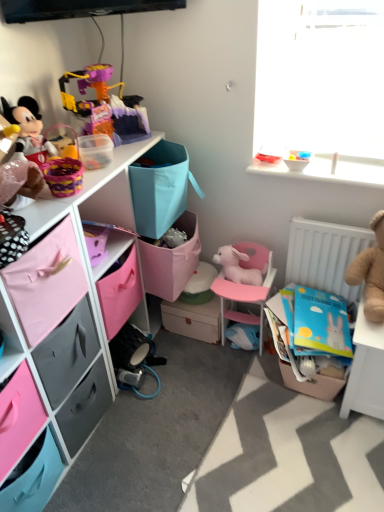
The width and height of the screenshot is (384, 512). Describe the element at coordinates (334, 163) in the screenshot. I see `white plastic spoon at upper right, the 2th toy from the right` at that location.

Locate an element on the screen. The width and height of the screenshot is (384, 512). matte pink storage box at center, which is the first storage box in left-to-right order is located at coordinates (193, 319).

In order to face brown plush bear at right, which is the 1th toy in right-to-left order, should I rotate leftwards or rightwards?

Rotate right and turn 23.357 degrees.

Locate an element on the screen. This screenshot has height=512, width=384. white plastic spoon at upper right, the 2th toy from the right is located at coordinates (334, 163).

Considering the relative sizes of plastic toy at upper left, the second toy positioned from the left, and blue cardboard box at lower right, placed as the 1th storage box when sorted from right to left, in the image provided, is plastic toy at upper left, the second toy positioned from the left, thinner than blue cardboard box at lower right, placed as the 1th storage box when sorted from right to left,?

Indeed, plastic toy at upper left, the second toy positioned from the left, has a lesser width compared to blue cardboard box at lower right, placed as the 1th storage box when sorted from right to left.

In terms of size, does plastic toy at upper left, the second toy positioned from the left, appear bigger or smaller than blue cardboard box at lower right, the 2th storage box from the back?

In the image, plastic toy at upper left, the second toy positioned from the left, appears to be larger than blue cardboard box at lower right, the 2th storage box from the back.

From the picture: From a real-world perspective, which object rests below the other?

blue cardboard box at lower right, placed as the 1th storage box when sorted from right to left.

Locate an element on the screen. the 1st storage box behind the plastic toy at upper left, placed as the sixth toy when sorted from right to left is located at coordinates (315, 340).

From the image's perspective, is brown plush bear at right, the 7th toy when ordered from left to right, positioned above or below white plastic spoon at upper right, the 2th toy from the right?

Based on their image positions, brown plush bear at right, the 7th toy when ordered from left to right, is located beneath white plastic spoon at upper right, the 2th toy from the right.

Is point (352, 279) farther from camera compared to point (334, 156)?

No, (352, 279) is in front of (334, 156).

Does brown plush bear at right, the 7th toy when ordered from left to right, appear on the left side of white plastic spoon at upper right, the 2th toy from the right?

No.

Is brown plush bear at right, which is the 1th toy in right-to-left order, positioned beyond the bounds of white plastic spoon at upper right, the 6th toy viewed from the left?

brown plush bear at right, which is the 1th toy in right-to-left order, lies outside white plastic spoon at upper right, the 6th toy viewed from the left,'s area.

Considering the relative sizes of pink plush rabbit at center, which is the 5th toy in right-to-left order, and rubber duck at upper right, placed as the 4th toy when sorted from left to right, in the image provided, is pink plush rabbit at center, which is the 5th toy in right-to-left order, taller than rubber duck at upper right, placed as the 4th toy when sorted from left to right,?

Yes.

Based on the photo, does pink plush rabbit at center, which is the 5th toy in right-to-left order, have a lesser width compared to rubber duck at upper right, placed as the 4th toy when sorted from left to right?

Incorrect, the width of pink plush rabbit at center, which is the 5th toy in right-to-left order, is not less than that of rubber duck at upper right, placed as the 4th toy when sorted from left to right.

Is point (224, 267) closer to viewer compared to point (260, 160)?

No.

Can you tell me how much pink plush rabbit at center, which is the 3th toy in left-to-right order, and rubber duck at upper right, placed as the 4th toy when sorted from left to right, differ in facing direction?

0.894 degrees separate the facing orientations of pink plush rabbit at center, which is the 3th toy in left-to-right order, and rubber duck at upper right, placed as the 4th toy when sorted from left to right.

Considering the positions of objects blue cardboard box at lower right, which is the 1th storage box from front to back, and pink fabric drawer at lower left, positioned as the second drawer in back-to-front order, in the image provided, who is more to the right, blue cardboard box at lower right, which is the 1th storage box from front to back, or pink fabric drawer at lower left, positioned as the second drawer in back-to-front order,?

blue cardboard box at lower right, which is the 1th storage box from front to back.

Measure the distance between blue cardboard box at lower right, placed as the 1th storage box when sorted from right to left, and pink fabric drawer at lower left, positioned as the second drawer in back-to-front order.

The distance of blue cardboard box at lower right, placed as the 1th storage box when sorted from right to left, from pink fabric drawer at lower left, positioned as the second drawer in back-to-front order, is 97.15 centimeters.

Is blue cardboard box at lower right, which is the 1th storage box from front to back, thinner than pink fabric drawer at lower left, positioned as the second drawer in back-to-front order?

No, blue cardboard box at lower right, which is the 1th storage box from front to back, is not thinner than pink fabric drawer at lower left, positioned as the second drawer in back-to-front order.

Does blue cardboard box at lower right, placed as the 1th storage box when sorted from right to left, have a smaller size compared to pink fabric drawer at lower left, positioned as the second drawer in back-to-front order?

Correct, blue cardboard box at lower right, placed as the 1th storage box when sorted from right to left, occupies less space than pink fabric drawer at lower left, positioned as the second drawer in back-to-front order.

Is the position of translucent plastic bowl at upper right, which is counted as the 3th toy, starting from the right, more distant than that of blue cardboard box at lower right, the 2th storage box from the back?

Yes, it is.

Which is correct: translucent plastic bowl at upper right, which is counted as the 3th toy, starting from the right, is inside blue cardboard box at lower right, marked as the second storage box in a left-to-right arrangement, or outside of it?

translucent plastic bowl at upper right, which is counted as the 3th toy, starting from the right, is located beyond the bounds of blue cardboard box at lower right, marked as the second storage box in a left-to-right arrangement.

How far apart are translucent plastic bowl at upper right, which is counted as the 3th toy, starting from the right, and blue cardboard box at lower right, the 2th storage box from the back?

translucent plastic bowl at upper right, which is counted as the 3th toy, starting from the right, is 24.87 inches from blue cardboard box at lower right, the 2th storage box from the back.

Is translucent plastic bowl at upper right, which is counted as the 3th toy, starting from the right, shorter than blue cardboard box at lower right, marked as the second storage box in a left-to-right arrangement?

Indeed, translucent plastic bowl at upper right, which is counted as the 3th toy, starting from the right, has a lesser height compared to blue cardboard box at lower right, marked as the second storage box in a left-to-right arrangement.

Could you tell me if pink fabric storage unit at left is turned towards pink plastic chair at center?

Yes, pink fabric storage unit at left is aimed at pink plastic chair at center.

Is pink plastic chair at center completely or partially inside pink fabric storage unit at left?

Actually, pink plastic chair at center is outside pink fabric storage unit at left.

Identify the location of chair that appears on the right of pink fabric storage unit at left. This screenshot has width=384, height=512. (246, 288).

Is point (114, 195) behind point (248, 303)?

No, (114, 195) is in front of (248, 303).

In the scene shown: Can you confirm if pink fabric drawer at lower left, which is the first drawer in front-to-back order, is smaller than matte pink storage box at center, placed as the 1th storage box when sorted from back to front?

Incorrect, pink fabric drawer at lower left, which is the first drawer in front-to-back order, is not smaller in size than matte pink storage box at center, placed as the 1th storage box when sorted from back to front.

Which is correct: pink fabric drawer at lower left, which is the first drawer in front-to-back order, is inside matte pink storage box at center, which is the first storage box in left-to-right order, or outside of it?

pink fabric drawer at lower left, which is the first drawer in front-to-back order, exists outside the volume of matte pink storage box at center, which is the first storage box in left-to-right order.

Relative to matte pink storage box at center, placed as the 1th storage box when sorted from back to front, is pink fabric drawer at lower left, positioned as the second drawer in back-to-front order, in front or behind?

In the image, pink fabric drawer at lower left, positioned as the second drawer in back-to-front order, appears in front of matte pink storage box at center, placed as the 1th storage box when sorted from back to front.

Where is `the 1st storage box positioned below the plastic toy at upper left, placed as the sixth toy when sorted from right to left (from the image's perspective)`? the 1st storage box positioned below the plastic toy at upper left, placed as the sixth toy when sorted from right to left (from the image's perspective) is located at coordinates (315, 340).

From the image's perspective, which toy is the 1st one above the brown plush bear at right, which is the 1th toy in right-to-left order? Please provide its 2D coordinates.

[(334, 163)]

Which object lies further to the anchor point plastic toy at upper left, placed as the sixth toy when sorted from right to left, brown plush bear at right, the 7th toy when ordered from left to right, or pink plush rabbit at center, which is the 3th toy in left-to-right order?

brown plush bear at right, the 7th toy when ordered from left to right, lies further to plastic toy at upper left, placed as the sixth toy when sorted from right to left, than the other object.

Considering their positions, is pink plush rabbit at center, which is the 5th toy in right-to-left order, positioned further to matte black plush toy at left, which is counted as the seventh toy, starting from the right, than translucent plastic bowl at upper right, which is counted as the 3th toy, starting from the right?

translucent plastic bowl at upper right, which is counted as the 3th toy, starting from the right, lies further to matte black plush toy at left, which is counted as the seventh toy, starting from the right, than the other object.

Consider the image. From the image, which object appears to be farther from gray matte drawer at lower left, placed as the 2th drawer when sorted from front to back, translucent plastic bowl at upper right, which is counted as the 3th toy, starting from the right, or matte black plush toy at left, which is counted as the seventh toy, starting from the right?

translucent plastic bowl at upper right, which is counted as the 3th toy, starting from the right.

Considering their positions, is blue cardboard box at lower right, marked as the second storage box in a left-to-right arrangement, positioned further to pink plastic chair at center than matte black plush toy at left, which is counted as the seventh toy, starting from the right?

matte black plush toy at left, which is counted as the seventh toy, starting from the right, is positioned further to the anchor pink plastic chair at center.

Based on their spatial positions, is gray matte drawer at lower left, the 1th drawer in the back-to-front sequence, or pink plastic chair at center further from translucent plastic bowl at upper right, which is counted as the 3th toy, starting from the right?

gray matte drawer at lower left, the 1th drawer in the back-to-front sequence.

Based on their spatial positions, is plastic toy at upper left, the second toy positioned from the left, or gray matte drawer at lower left, the 1th drawer in the back-to-front sequence, further from matte black plush toy at left, which ranks as the 1th toy in left-to-right order?

gray matte drawer at lower left, the 1th drawer in the back-to-front sequence, is further to matte black plush toy at left, which ranks as the 1th toy in left-to-right order.

Considering their positions, is pink plush rabbit at center, which is the 5th toy in right-to-left order, positioned further to pink fabric storage unit at left than blue cardboard box at lower right, placed as the 1th storage box when sorted from right to left?

The object further to pink fabric storage unit at left is blue cardboard box at lower right, placed as the 1th storage box when sorted from right to left.

Consider the image. Looking at the image, which one is located further to rubber duck at upper right, placed as the 4th toy when sorted from left to right, pink fabric storage unit at left or pink fabric drawer at lower left, positioned as the second drawer in back-to-front order?

The object further to rubber duck at upper right, placed as the 4th toy when sorted from left to right, is pink fabric drawer at lower left, positioned as the second drawer in back-to-front order.

At what (x,y) coordinates should I click in order to perform the action: click on drawer situated between matte black plush toy at left, which is counted as the seventh toy, starting from the right, and pink plush rabbit at center, which is the 3th toy in left-to-right order, from left to right. Please return your answer as a coordinate pair (x, y). This screenshot has height=512, width=384. Looking at the image, I should click on (67, 352).

At what (x,y) coordinates should I click in order to perform the action: click on cabinetry between matte black plush toy at left, which is counted as the seventh toy, starting from the right, and gray matte drawer at lower left, the 1th drawer in the back-to-front sequence, in the up-down direction. Please return your answer as a coordinate pair (x, y). The width and height of the screenshot is (384, 512). Looking at the image, I should click on (78, 302).

Where is `drawer situated between pink fabric drawer at lower left, which is the first drawer in front-to-back order, and pink plastic chair at center from left to right`? The height and width of the screenshot is (512, 384). drawer situated between pink fabric drawer at lower left, which is the first drawer in front-to-back order, and pink plastic chair at center from left to right is located at coordinates (67, 352).

Image resolution: width=384 pixels, height=512 pixels. I want to click on storage box between pink fabric storage unit at left and matte pink storage box at center, the second storage box when ordered from right to left, from front to back, so click(315, 340).